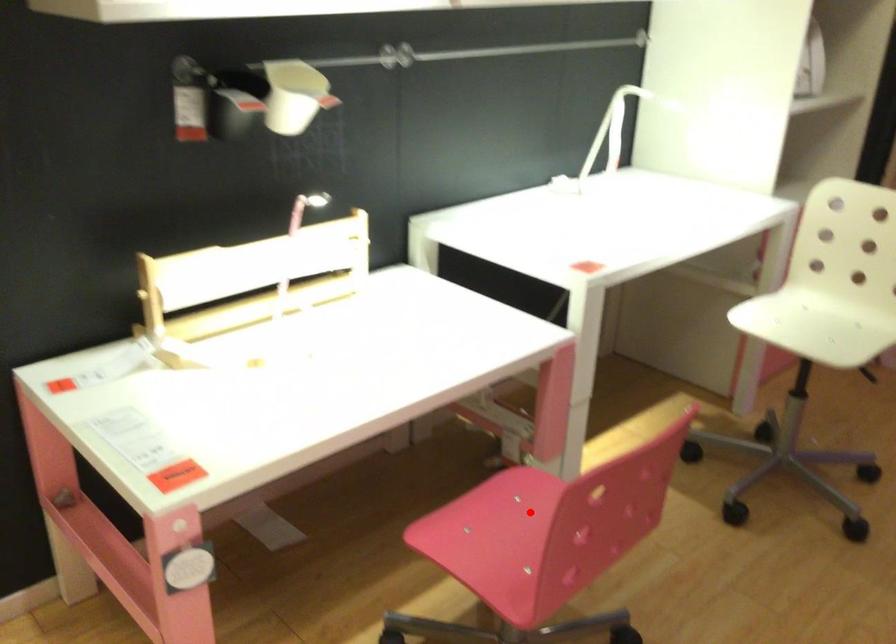
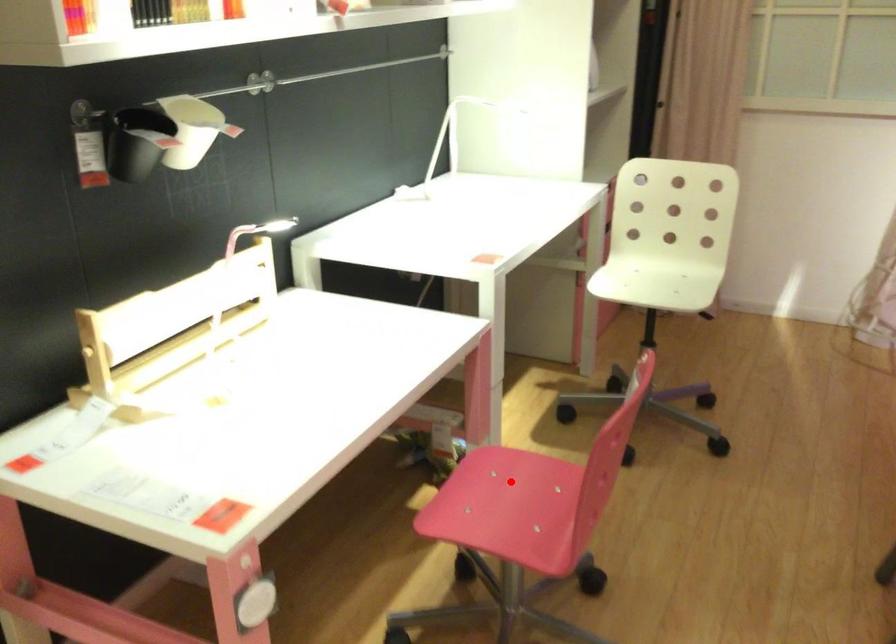
I am providing you with two images of the same scene from different viewpoints. A red point is marked on the first image and another point is marked on the second image. Is the red point in image1 aligned with the point shown in image2?

Yes